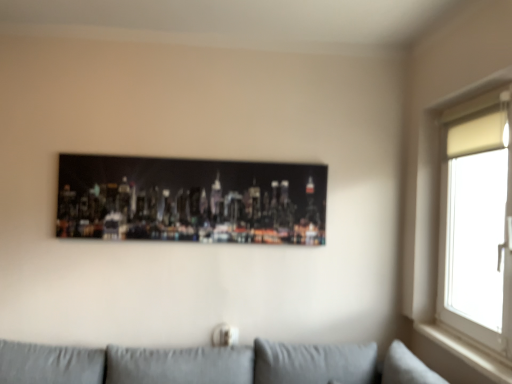
Where is `metallic cityscape print at center`? The width and height of the screenshot is (512, 384). metallic cityscape print at center is located at coordinates (191, 200).

Where is `white wood window sill at right`? Image resolution: width=512 pixels, height=384 pixels. white wood window sill at right is located at coordinates (467, 352).

In order to face white matte window at upper right, should I rotate leftwards or rightwards?

Turn right by 26.545 degrees to look at white matte window at upper right.

Where is `metallic cityscape print at center`? The width and height of the screenshot is (512, 384). metallic cityscape print at center is located at coordinates (191, 200).

Can you confirm if white wood window sill at right is smaller than white matte window at upper right?

Yes, white wood window sill at right is smaller than white matte window at upper right.

Could you tell me if white wood window sill at right is turned towards white matte window at upper right?

Yes, white wood window sill at right is facing white matte window at upper right.

Is white wood window sill at right not within white matte window at upper right?

That's incorrect, white wood window sill at right is not completely outside white matte window at upper right.

From a real-world perspective, is white wood window sill at right physically located above or below white matte window at upper right?

In terms of real-world spatial position, white wood window sill at right is below white matte window at upper right.

Is the surface of metallic cityscape print at center in direct contact with white matte window at upper right?

No, metallic cityscape print at center is not making contact with white matte window at upper right.

From the image's perspective, is metallic cityscape print at center below white matte window at upper right?

Actually, metallic cityscape print at center appears above white matte window at upper right in the image.

What are the coordinates of `window on the right of the metallic cityscape print at center` in the screenshot? It's located at (476, 219).

How far apart are metallic cityscape print at center and white matte window at upper right?

metallic cityscape print at center is 3.41 feet from white matte window at upper right.

Is metallic cityscape print at center positioned with its back to white wood window sill at right?

No, metallic cityscape print at center is not facing the opposite direction of white wood window sill at right.

From the image's perspective, is metallic cityscape print at center on top of white wood window sill at right?

Yes, from the image's perspective, metallic cityscape print at center is on top of white wood window sill at right.

Does metallic cityscape print at center have a greater height compared to white wood window sill at right?

Yes, metallic cityscape print at center is taller than white wood window sill at right.

Can you confirm if metallic cityscape print at center is smaller than white wood window sill at right?

Incorrect, metallic cityscape print at center is not smaller in size than white wood window sill at right.

Does white wood window sill at right have a larger size compared to metallic cityscape print at center?

No, white wood window sill at right is not bigger than metallic cityscape print at center.

Measure the distance between white wood window sill at right and metallic cityscape print at center.

1.26 meters.

Which of these two, white wood window sill at right or metallic cityscape print at center, is thinner?

With smaller width is metallic cityscape print at center.

Is white wood window sill at right inside the boundaries of metallic cityscape print at center, or outside?

white wood window sill at right lies outside metallic cityscape print at center.

Which object is more forward, white matte window at upper right or metallic cityscape print at center?

Positioned in front is white matte window at upper right.

In order to click on picture frame that is on the left side of white matte window at upper right in this screenshot , I will do `click(191, 200)`.

From a real-world perspective, is white matte window at upper right beneath metallic cityscape print at center?

Yes.

Can you confirm if white matte window at upper right is wider than metallic cityscape print at center?

Correct, the width of white matte window at upper right exceeds that of metallic cityscape print at center.

Is white matte window at upper right directly adjacent to white wood window sill at right?

No, white matte window at upper right is not beside white wood window sill at right.

Consider the image. From a real-world perspective, is white matte window at upper right positioned above or below white wood window sill at right?

Clearly, from a real-world perspective, white matte window at upper right is above white wood window sill at right.

Which of these two, white matte window at upper right or white wood window sill at right, is bigger?

white matte window at upper right is bigger.

From the image's perspective, is white matte window at upper right on top of white wood window sill at right?

Yes, from the image's perspective, white matte window at upper right is above white wood window sill at right.

The height and width of the screenshot is (384, 512). In order to click on window sill below the white matte window at upper right (from the image's perspective) in this screenshot , I will do `click(467, 352)`.

Locate an element on the screen. Image resolution: width=512 pixels, height=384 pixels. window lying on the right of metallic cityscape print at center is located at coordinates (x=476, y=219).

Consider the image. From the image, which object appears to be nearer to metallic cityscape print at center, white matte window at upper right or white wood window sill at right?

Among the two, white matte window at upper right is located nearer to metallic cityscape print at center.

When comparing their distances from white matte window at upper right, does white wood window sill at right or metallic cityscape print at center seem further?

metallic cityscape print at center is further to white matte window at upper right.

Estimate the real-world distances between objects in this image. Which object is further from white wood window sill at right, metallic cityscape print at center or white matte window at upper right?

Based on the image, metallic cityscape print at center appears to be further to white wood window sill at right.

Based on their spatial positions, is white matte window at upper right or metallic cityscape print at center closer to white wood window sill at right?

white matte window at upper right is positioned closer to the anchor white wood window sill at right.

When comparing their distances from metallic cityscape print at center, does white wood window sill at right or white matte window at upper right seem further?

white wood window sill at right lies further to metallic cityscape print at center than the other object.

When comparing their distances from white matte window at upper right, does metallic cityscape print at center or white wood window sill at right seem closer?

white wood window sill at right lies closer to white matte window at upper right than the other object.

This screenshot has width=512, height=384. In order to click on window sill between metallic cityscape print at center and white matte window at upper right in this screenshot , I will do `click(467, 352)`.